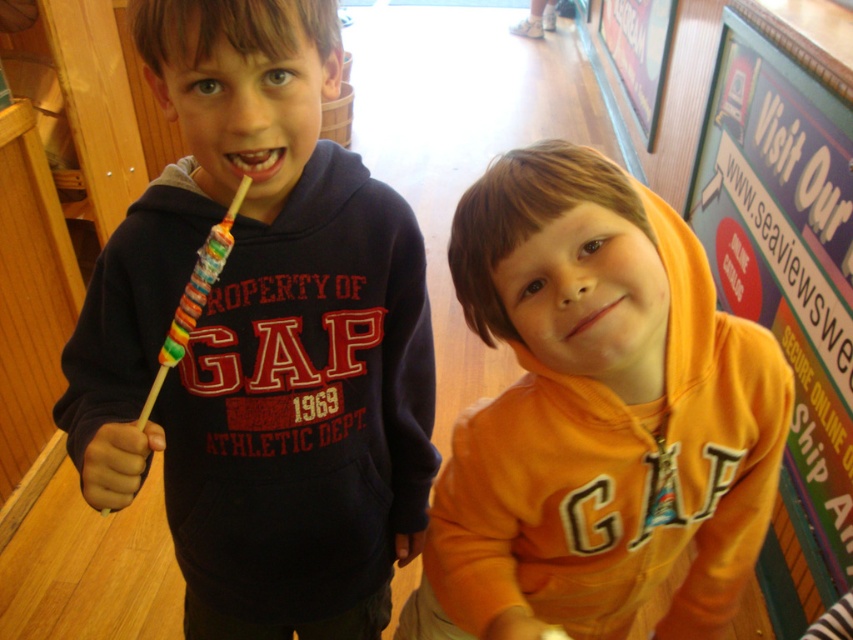
Does matte black hoodie at center appear on the right side of rainbow candy lollipop at left?

Yes, matte black hoodie at center is to the right of rainbow candy lollipop at left.

Is point (202, 429) farther from camera compared to point (187, 324)?

Yes, point (202, 429) is behind point (187, 324).

You are a GUI agent. You are given a task and a screenshot of the screen. Output one action in this format:
    pyautogui.click(x=<x>, y=<y>)
    Task: Click on the matte black hoodie at center
    The image size is (853, 640).
    Given the screenshot: What is the action you would take?
    pyautogui.click(x=262, y=339)

Is rainbow candy lollipop at left shorter than pink matte lips at center?

Incorrect, rainbow candy lollipop at left's height does not fall short of pink matte lips at center's.

In the scene shown: Does rainbow candy lollipop at left appear over pink matte lips at center?

Actually, rainbow candy lollipop at left is below pink matte lips at center.

Who is more forward, (167, 342) or (576, 332)?

Positioned in front is point (576, 332).

Identify the location of rainbow candy lollipop at left. (194, 296).

Between matte black hoodie at center and matte plastic sign at upper right, which one is positioned higher?

Positioned higher is matte plastic sign at upper right.

Can you confirm if matte black hoodie at center is smaller than matte plastic sign at upper right?

Yes, matte black hoodie at center is smaller than matte plastic sign at upper right.

Describe the element at coordinates (262, 339) in the screenshot. I see `matte black hoodie at center` at that location.

The image size is (853, 640). I want to click on matte black hoodie at center, so click(x=262, y=339).